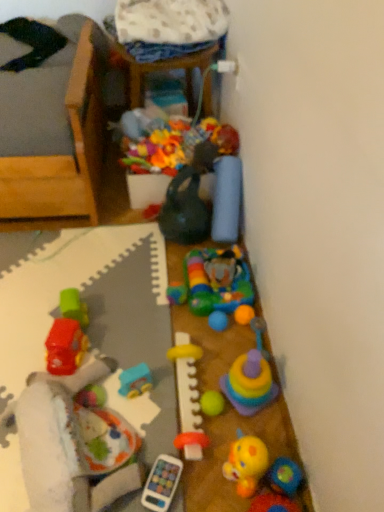
Locate an element on the screen. The image size is (384, 512). vacant space situated above rubberized plastic elephant at center, marked as the 6th toy in a right-to-left arrangement (from a real-world perspective) is located at coordinates (215, 279).